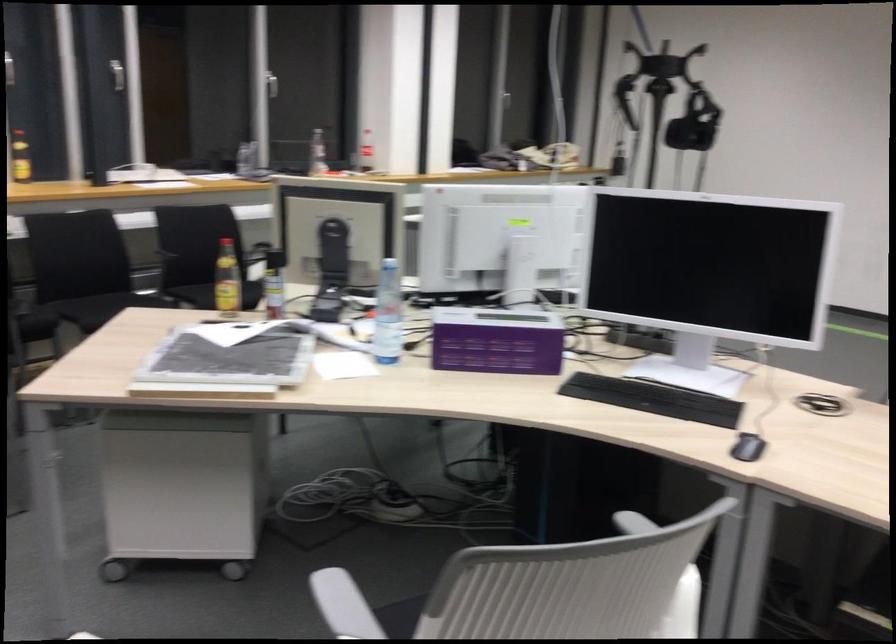
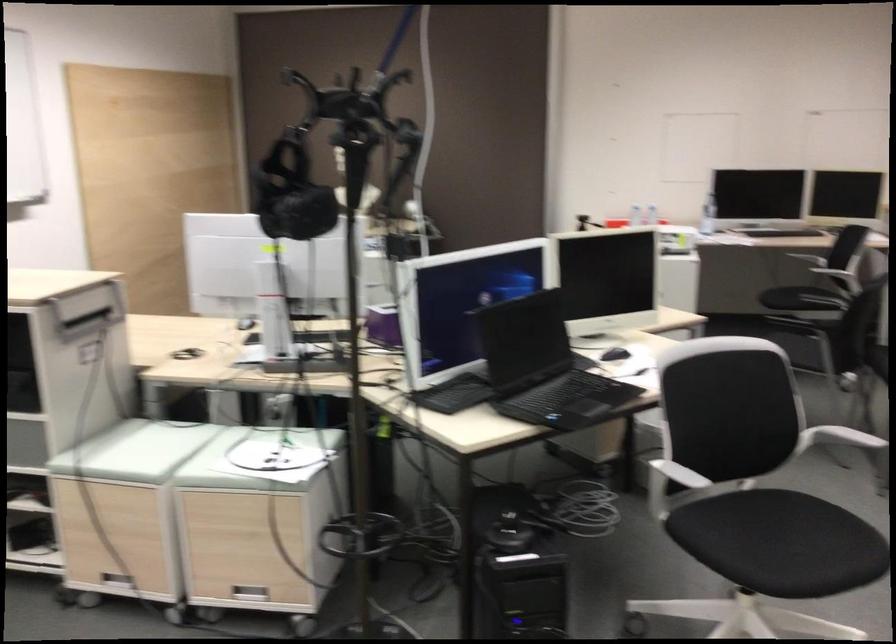
Question: I am providing you with two images of the same scene from different viewpoints. After the viewpoint changes to image2, which objects are now occluded?

Choices:
 (A) chair sitting surface
 (B) black chair sitting surface
 (C) white chair armrest
 (D) paper with clip

Answer: (A)